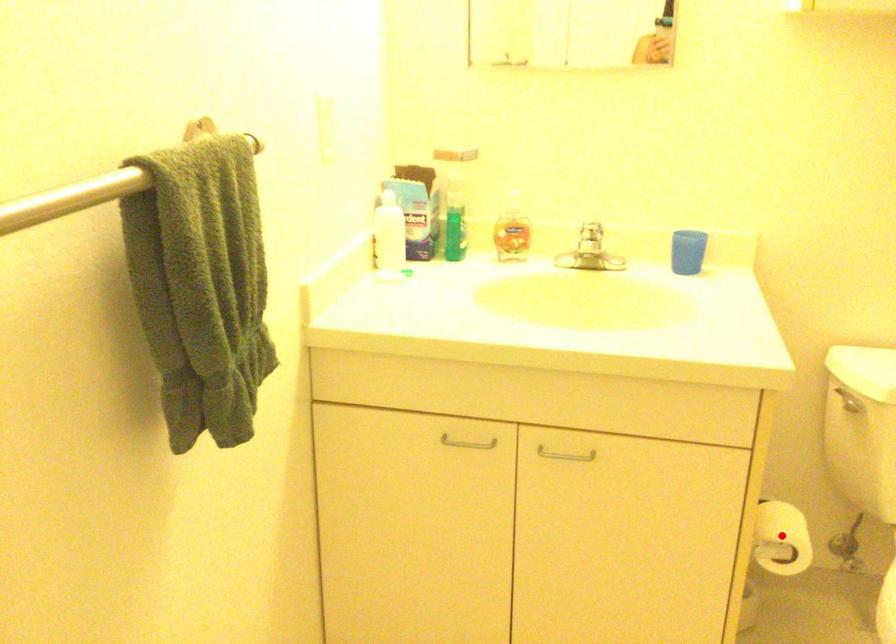
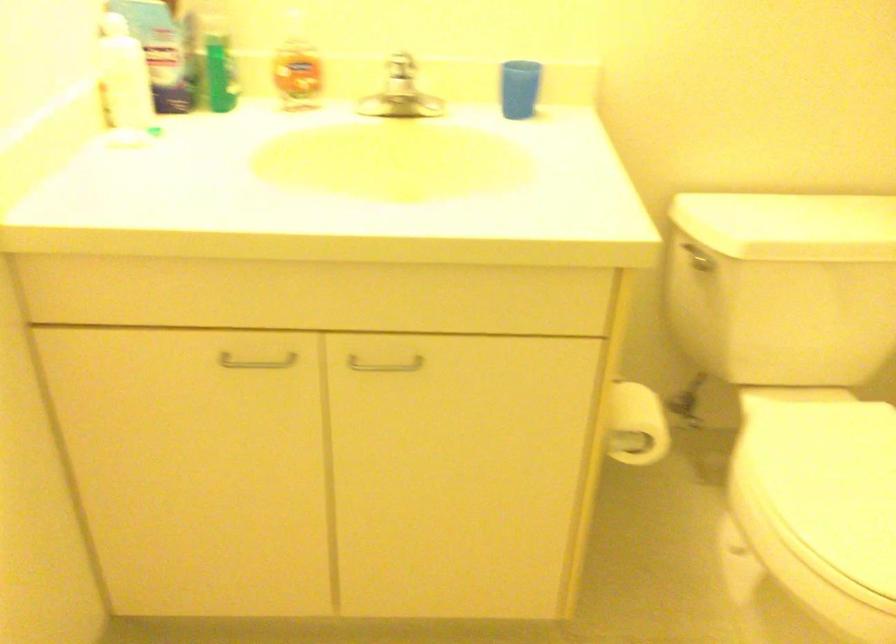
In the second image, find the point that corresponds to the highlighted location in the first image.

(635, 424)